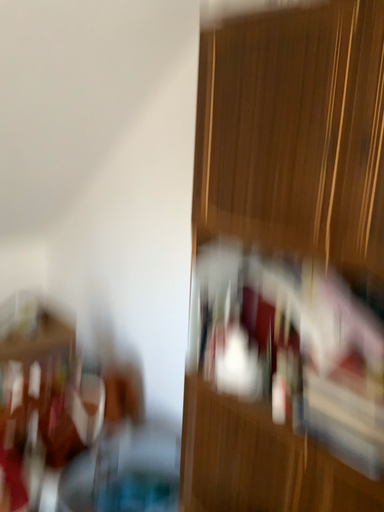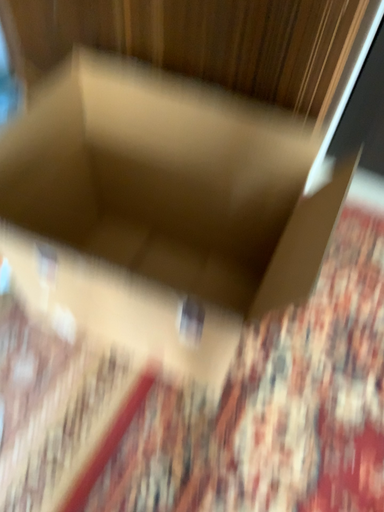
Question: How did the camera likely rotate when shooting the video?

Choices:
 (A) rotated downward
 (B) rotated upward

Answer: (A)